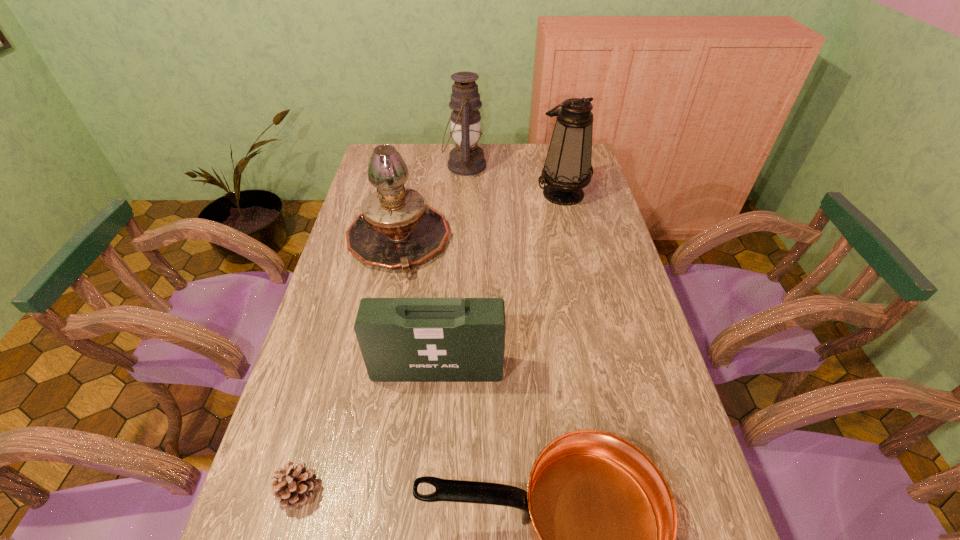
Find the location of a particular element. The height and width of the screenshot is (540, 960). object that is at the right edge is located at coordinates (567, 169).

You are a GUI agent. You are given a task and a screenshot of the screen. Output one action in this format:
    pyautogui.click(x=<x>, y=<y>)
    Task: Click on the free space at the far edge of the desktop
    Image resolution: width=960 pixels, height=540 pixels.
    Given the screenshot: What is the action you would take?
    [489, 170]

The height and width of the screenshot is (540, 960). I want to click on free region at the left edge, so click(370, 185).

In the image, there is a desktop. Identify the location of vacant space at the right edge. (591, 211).

Where is `free area in between the fourth tallest object and the rightmost oil lamp`? The image size is (960, 540). free area in between the fourth tallest object and the rightmost oil lamp is located at coordinates (500, 281).

Locate which object is the fourth closest to the rightmost oil lamp. Please provide its 2D coordinates. Your answer should be formatted as a tuple, i.e. [(x, y)], where the tuple contains the x and y coordinates of a point satisfying the conditions above.

[(602, 517)]

At what (x,y) coordinates should I click in order to perform the action: click on object that ranks as the fourth closest to the shortest object. Please return your answer as a coordinate pair (x, y). The width and height of the screenshot is (960, 540). Looking at the image, I should click on (567, 169).

Identify which oil lamp is the second closest to the rightmost oil lamp. Please provide its 2D coordinates. Your answer should be formatted as a tuple, i.e. [(x, y)], where the tuple contains the x and y coordinates of a point satisfying the conditions above.

[(396, 229)]

This screenshot has width=960, height=540. I want to click on oil lamp that is the second closest to the rightmost oil lamp, so click(x=396, y=229).